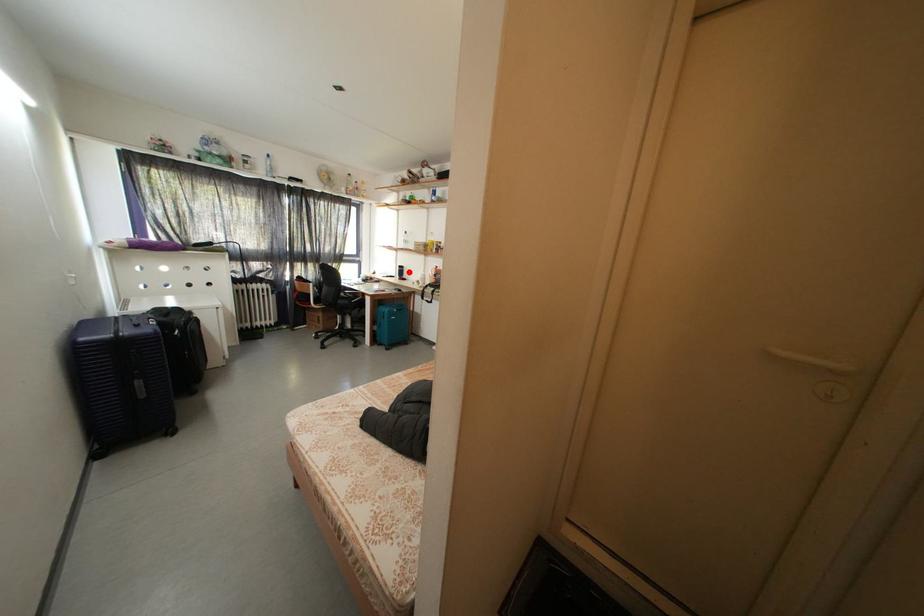
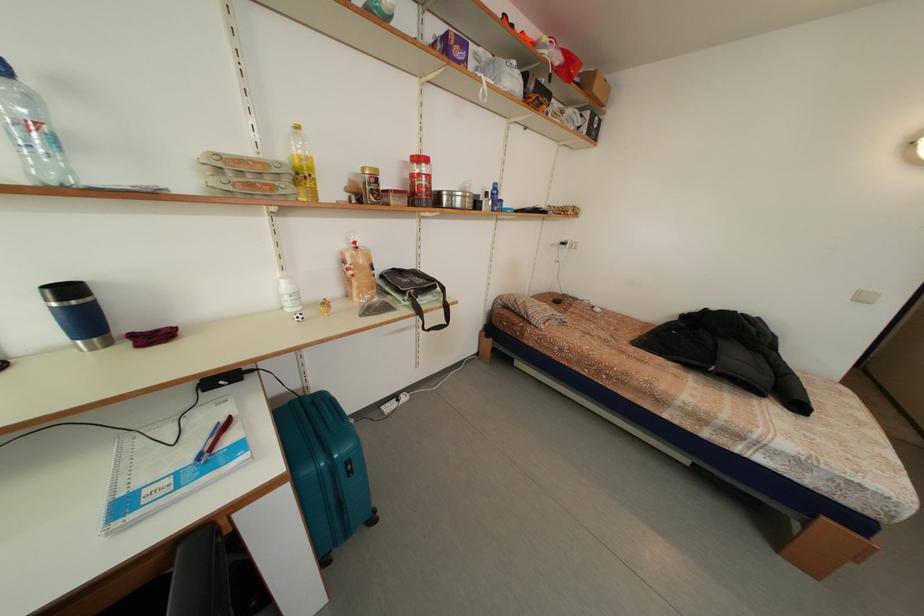
Find the pixel in the second image that matches the highlighted location in the first image.

(78, 296)